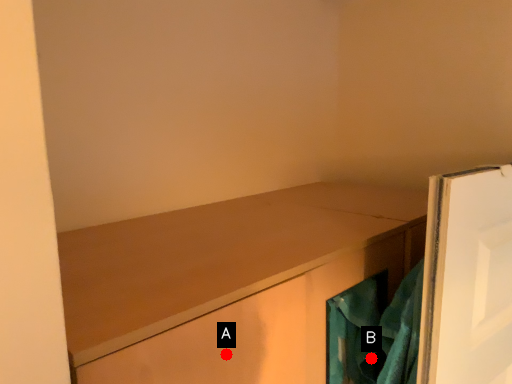
Question: Two points are circled on the image, labeled by A and B beside each circle. Which of the following is the farthest from the observer?

Choices:
 (A) A is further
 (B) B is further

Answer: (B)